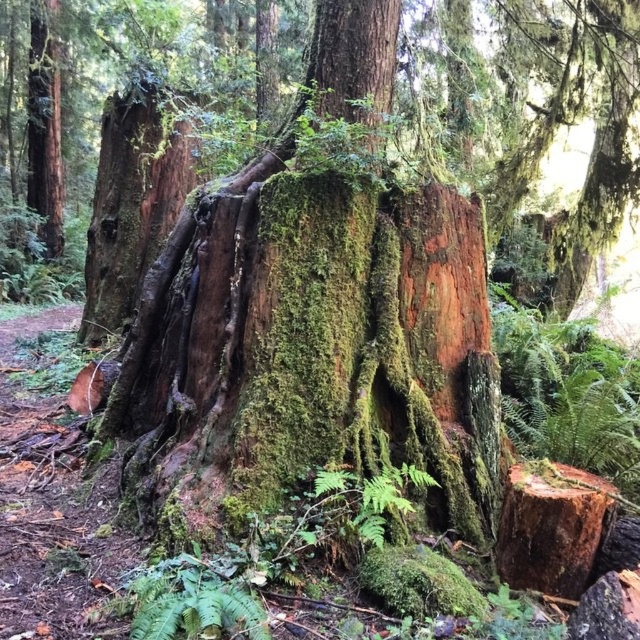
You are a hiker who wants to take a photo of the green mossy fern at center. Since the green mossy stump at center is blocking your view, can you move to the left or right to get a clear shot?

The green mossy fern at center is behind the green mossy stump at center, so moving to the left or right might allow you to see around the stump and capture the fern in your photo.

You are a hiker who wants to take a photo of the smooth brown tree trunk at upper left and the green mossy fern at center. Which object should you focus on first if you want to capture both in the same frame without moving your camera?

The smooth brown tree trunk at upper left is located above the green mossy fern at center, so you should focus on the smooth brown tree trunk at upper left first to ensure both are in the frame.

You are standing in the forest scene looking at the point marked at coordinates (518,525). If you want to place a small 0.5 meter wide flowerpot there, will it fit without overlapping any nearby objects?

The point at (518,525) is 1.92 meters away from the viewer, so placing a 0.5 meter wide flowerpot there should be possible as there is enough space.